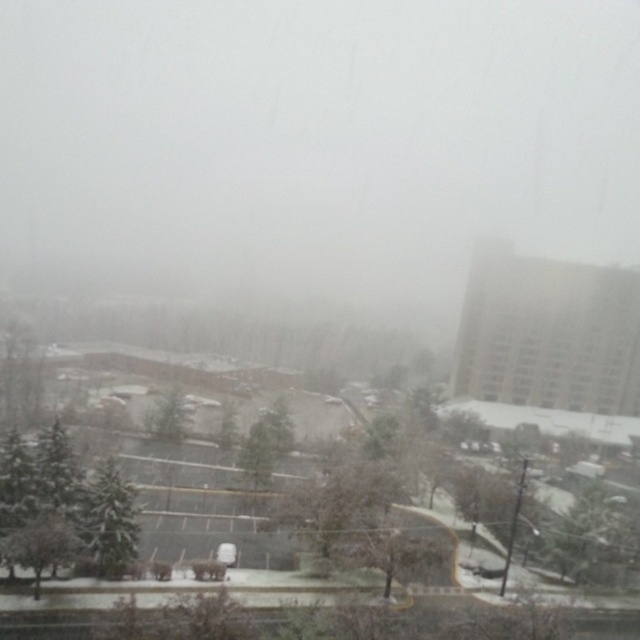
Find the location of `green matte tree at center-left`. green matte tree at center-left is located at coordinates (108, 524).

Does point (92, 554) come farther from viewer compared to point (51, 516)?

Yes.

Is point (131, 560) farther from camera compared to point (42, 515)?

Yes, it is.

Locate an element on the screen. Image resolution: width=640 pixels, height=640 pixels. green matte tree at center-left is located at coordinates (108, 524).

Is snow-covered tree at lower left taller than green matte tree at center?

No.

Who is more distant from viewer, (38, 552) or (180, 410)?

The point (180, 410) is more distant.

Is point (65, 536) farther from viewer compared to point (164, 397)?

No, (65, 536) is in front of (164, 397).

Identify the location of snow-covered tree at lower left. (42, 545).

Can you confirm if green matte tree at center-left is positioned below green matte tree at center?

Yes.

Is green matte tree at center-left smaller than green matte tree at center?

Yes, green matte tree at center-left is smaller than green matte tree at center.

Where is `green matte tree at center-left`? The image size is (640, 640). green matte tree at center-left is located at coordinates (108, 524).